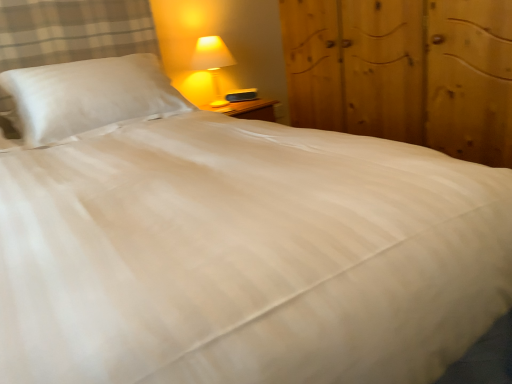
Question: Is wooden dresser at right shorter than matte yellow plastic lamp at upper right?

Choices:
 (A) yes
 (B) no

Answer: (B)

Question: Does wooden dresser at right come in front of matte yellow plastic lamp at upper right?

Choices:
 (A) no
 (B) yes

Answer: (B)

Question: From a real-world perspective, is wooden dresser at right on matte yellow plastic lamp at upper right?

Choices:
 (A) yes
 (B) no

Answer: (B)

Question: Is wooden dresser at right oriented towards matte yellow plastic lamp at upper right?

Choices:
 (A) yes
 (B) no

Answer: (B)

Question: Is wooden dresser at right at the left side of matte yellow plastic lamp at upper right?

Choices:
 (A) no
 (B) yes

Answer: (A)

Question: Is there a large distance between wooden dresser at right and matte yellow plastic lamp at upper right?

Choices:
 (A) no
 (B) yes

Answer: (A)

Question: Considering the relative sizes of wooden dresser at right and white satin pillow at upper left in the image provided, is wooden dresser at right taller than white satin pillow at upper left?

Choices:
 (A) yes
 (B) no

Answer: (A)

Question: Can you confirm if wooden dresser at right is positioned to the right of white satin pillow at upper left?

Choices:
 (A) no
 (B) yes

Answer: (B)

Question: Would you say wooden dresser at right contains white satin pillow at upper left?

Choices:
 (A) yes
 (B) no

Answer: (B)

Question: Is the depth of wooden dresser at right greater than that of white satin pillow at upper left?

Choices:
 (A) yes
 (B) no

Answer: (B)

Question: Is wooden dresser at right smaller than white satin pillow at upper left?

Choices:
 (A) yes
 (B) no

Answer: (B)

Question: From a real-world perspective, is wooden dresser at right on white satin pillow at upper left?

Choices:
 (A) yes
 (B) no

Answer: (B)

Question: From a real-world perspective, is white satin pillow at upper left physically below wooden dresser at right?

Choices:
 (A) yes
 (B) no

Answer: (B)